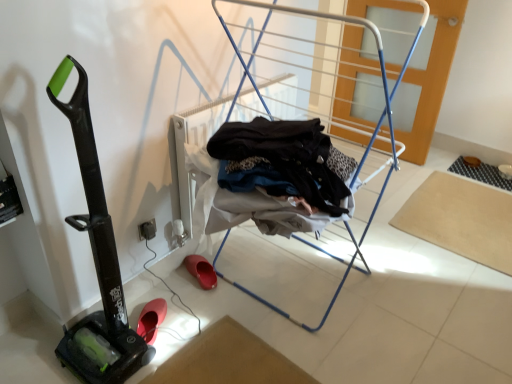
At what (x,y) coordinates should I click in order to perform the action: click on free location to the right of black rubber vacuum at left. Please return your answer as a coordinate pair (x, y). Image resolution: width=512 pixels, height=384 pixels. Looking at the image, I should click on (177, 345).